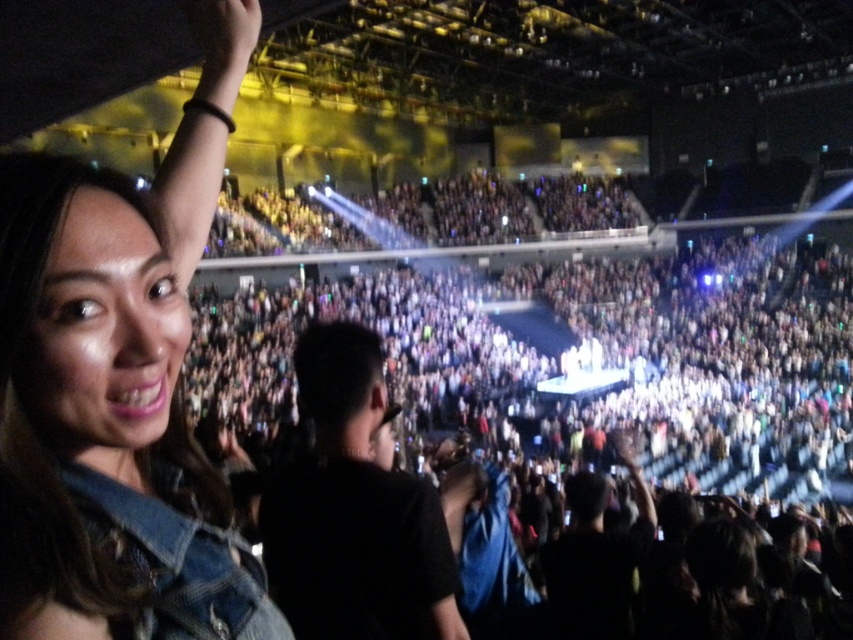
Question: Considering the real-world distances, which object is farthest from the black matte shirt at center?

Choices:
 (A) denim jacket at upper left
 (B) dark gray fabric crowd at center

Answer: (B)

Question: Which point is closer to the camera taking this photo?

Choices:
 (A) (788, 259)
 (B) (383, 518)
 (C) (68, 419)

Answer: (C)

Question: Among these points, which one is farthest from the camera?

Choices:
 (A) (820, 344)
 (B) (413, 573)

Answer: (A)

Question: Does denim jacket at upper left have a smaller size compared to black matte shirt at center?

Choices:
 (A) yes
 (B) no

Answer: (B)

Question: Is dark gray fabric crowd at center bigger than black matte shirt at center?

Choices:
 (A) no
 (B) yes

Answer: (B)

Question: Is dark gray fabric crowd at center below denim jacket at upper left?

Choices:
 (A) no
 (B) yes

Answer: (A)